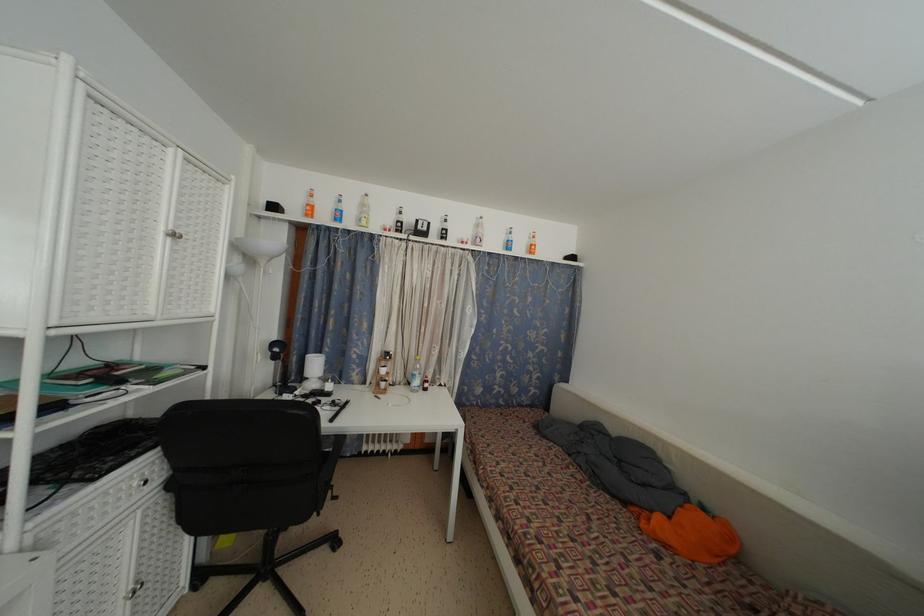
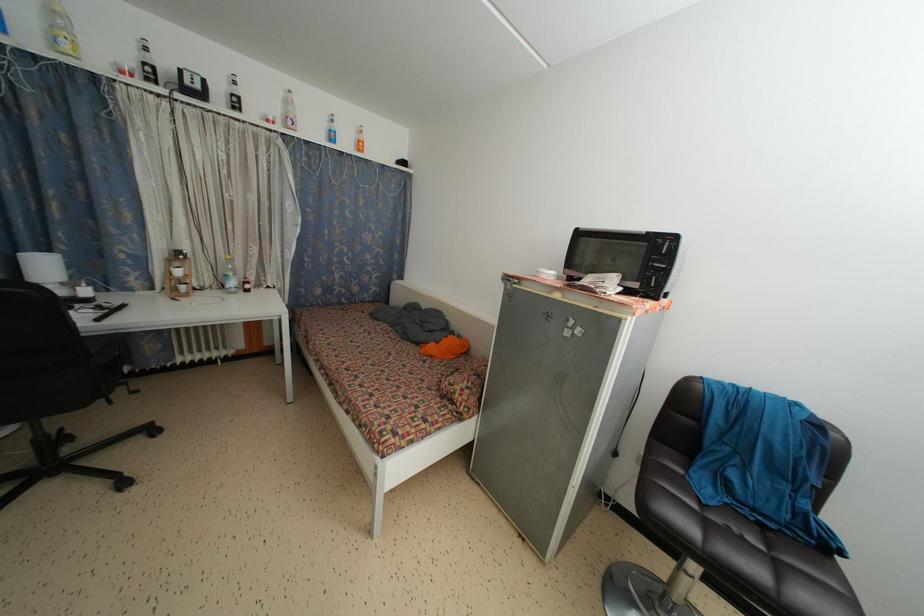
Find the pixel in the second image that matches (420,387) in the first image.

(237, 289)